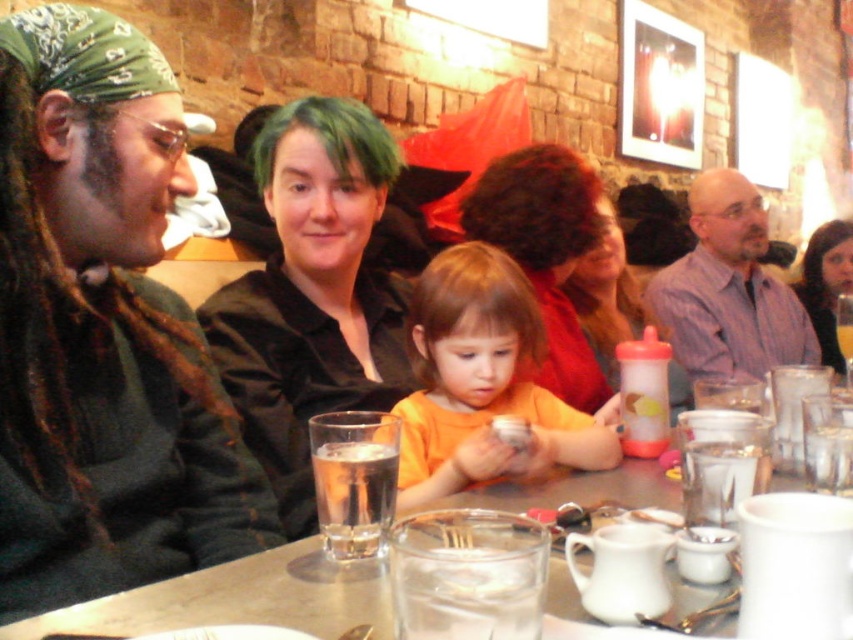
You are sitting at the table in the image and want to reach for an item. You notice two points marked on the table surface. Which point is closer to you, point at coordinate (486,244) or point at coordinate (490,163)?

Point at coordinate (486,244) is closer to you than point at coordinate (490,163).